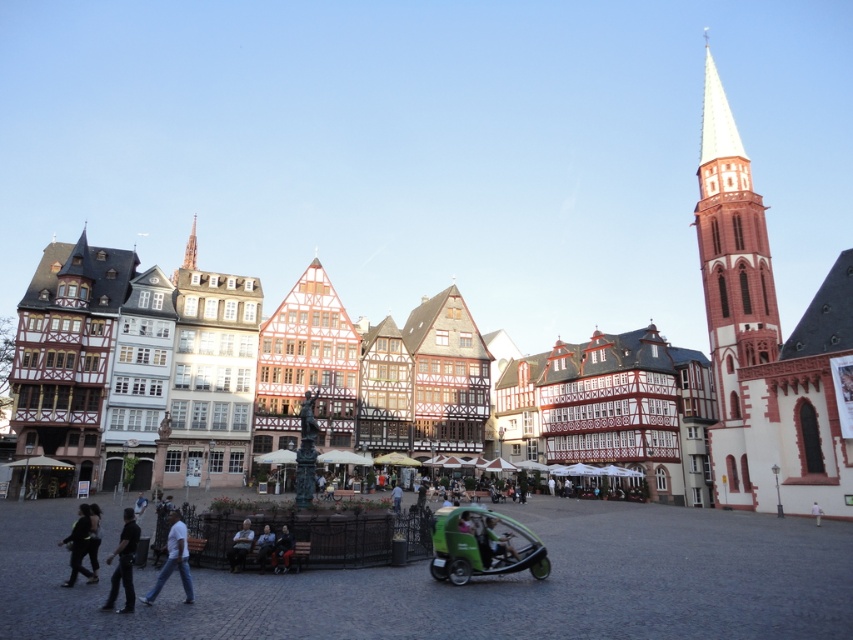
Based on the provided coordinates, which object in the scene is located at point (x=730, y=285)?

The white stone tower at upper right is located at point (x=730, y=285).

You are standing in the European town square and want to walk from point A to point B. Point A is at coordinate point (738, 422) and point B is at coordinate point (167, 536). Which point is closer to you when you start walking?

Point A at coordinate point (738, 422) is closer to you since it is further to the viewer than point B at coordinate point (167, 536).